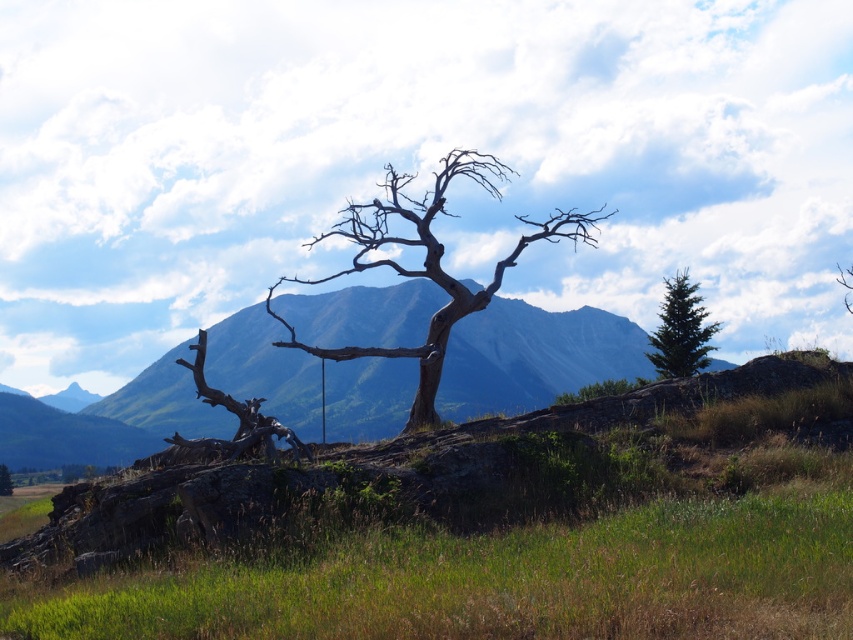
Can you confirm if green grassy at lower center is taller than green rock at center?

No.

In the scene shown: Does green grassy at lower center have a larger size compared to green rock at center?

No, green grassy at lower center is not bigger than green rock at center.

Does point (430, 636) come behind point (96, 449)?

That is False.

Locate an element on the screen. This screenshot has height=640, width=853. green grassy at lower center is located at coordinates (496, 580).

Who is lower down, brown rough bark tree at center or brown rough tree trunk at center?

brown rough tree trunk at center is lower down.

Is point (445, 177) in front of point (0, 465)?

Yes.

Is point (386, 189) closer to camera compared to point (7, 490)?

Yes, it is in front of point (7, 490).

The width and height of the screenshot is (853, 640). Find the location of `brown rough bark tree at center`. brown rough bark tree at center is located at coordinates (430, 262).

Does green grassy at lower center appear under brown rough bark tree at center?

Correct, green grassy at lower center is located below brown rough bark tree at center.

Can you confirm if green grassy at lower center is positioned above brown rough bark tree at center?

Incorrect, green grassy at lower center is not positioned above brown rough bark tree at center.

Locate an element on the screen. This screenshot has width=853, height=640. green grassy at lower center is located at coordinates (496, 580).

Where is `green grassy at lower center`? green grassy at lower center is located at coordinates (496, 580).